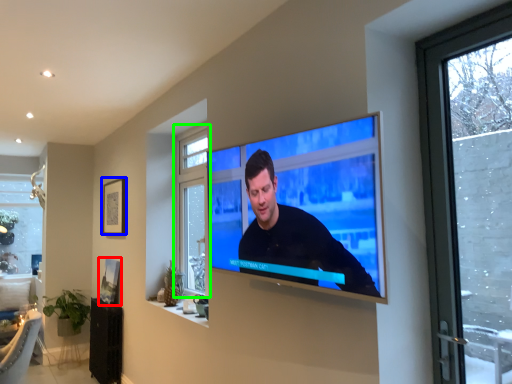
Question: Which is nearer to the picture frame (highlighted by a red box)? picture frame (highlighted by a blue box) or window (highlighted by a green box).

Choices:
 (A) picture frame
 (B) window

Answer: (A)